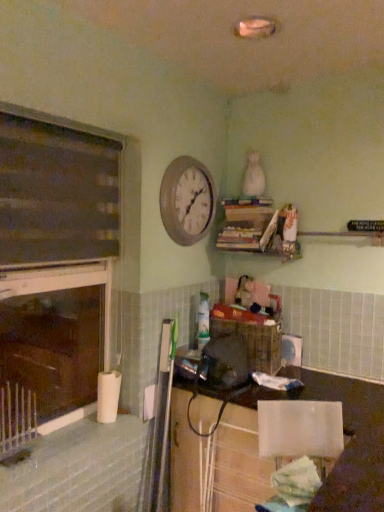
Question: Is dark wood window frame at left directly adjacent to wooden clock at upper center?

Choices:
 (A) yes
 (B) no

Answer: (B)

Question: From a real-world perspective, is dark wood window frame at left under wooden clock at upper center?

Choices:
 (A) yes
 (B) no

Answer: (A)

Question: Considering the relative sizes of dark wood window frame at left and wooden clock at upper center in the image provided, is dark wood window frame at left shorter than wooden clock at upper center?

Choices:
 (A) no
 (B) yes

Answer: (A)

Question: Is dark wood window frame at left behind wooden clock at upper center?

Choices:
 (A) yes
 (B) no

Answer: (B)

Question: Is dark wood window frame at left taller than wooden clock at upper center?

Choices:
 (A) no
 (B) yes

Answer: (B)

Question: Is silver metallic radiator at lower left to the left or to the right of dark wood window frame at left in the image?

Choices:
 (A) left
 (B) right

Answer: (A)

Question: From the image's perspective, relative to dark wood window frame at left, is silver metallic radiator at lower left above or below?

Choices:
 (A) above
 (B) below

Answer: (B)

Question: Is point (24, 440) closer or farther from the camera than point (56, 263)?

Choices:
 (A) farther
 (B) closer

Answer: (B)

Question: Is silver metallic radiator at lower left inside the boundaries of dark wood window frame at left, or outside?

Choices:
 (A) inside
 (B) outside

Answer: (A)

Question: Is white fabric chair at lower right situated inside white glossy lampshade at lower right or outside?

Choices:
 (A) outside
 (B) inside

Answer: (A)

Question: Looking at their shapes, would you say white fabric chair at lower right is wider or thinner than white glossy lampshade at lower right?

Choices:
 (A) wide
 (B) thin

Answer: (A)

Question: From the image's perspective, is white fabric chair at lower right located above or below white glossy lampshade at lower right?

Choices:
 (A) above
 (B) below

Answer: (A)

Question: Relative to white glossy lampshade at lower right, is white fabric chair at lower right in front or behind?

Choices:
 (A) behind
 (B) front

Answer: (B)

Question: Would you say wooden clock at upper center is to the left or to the right of silver metallic radiator at lower left in the picture?

Choices:
 (A) left
 (B) right

Answer: (B)

Question: In terms of size, does wooden clock at upper center appear bigger or smaller than silver metallic radiator at lower left?

Choices:
 (A) big
 (B) small

Answer: (A)